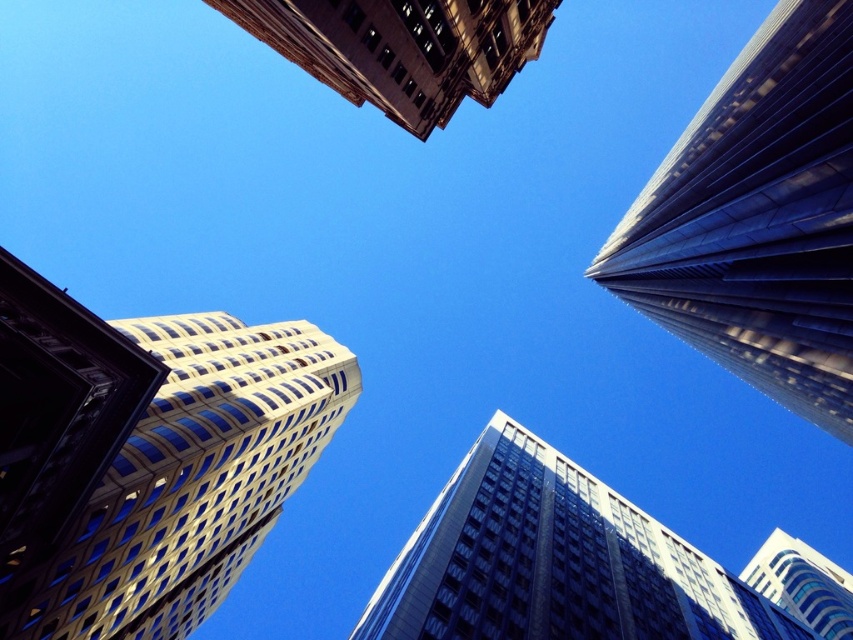
You are standing on the ground floor of a building and looking up. You want to take a photo of the brown stone building at upper center. Where should you aim your camera to capture it in the frame?

You should aim your camera at point [401,49] to capture the brown stone building at upper center in the frame.

You are a bird flying at a certain altitude. You see the glassy reflective skyscraper at center and the white glass building at upper right. Which building is higher in the sky?

The glassy reflective skyscraper at center is higher in the sky than the white glass building at upper right because it is positioned above it in the image.